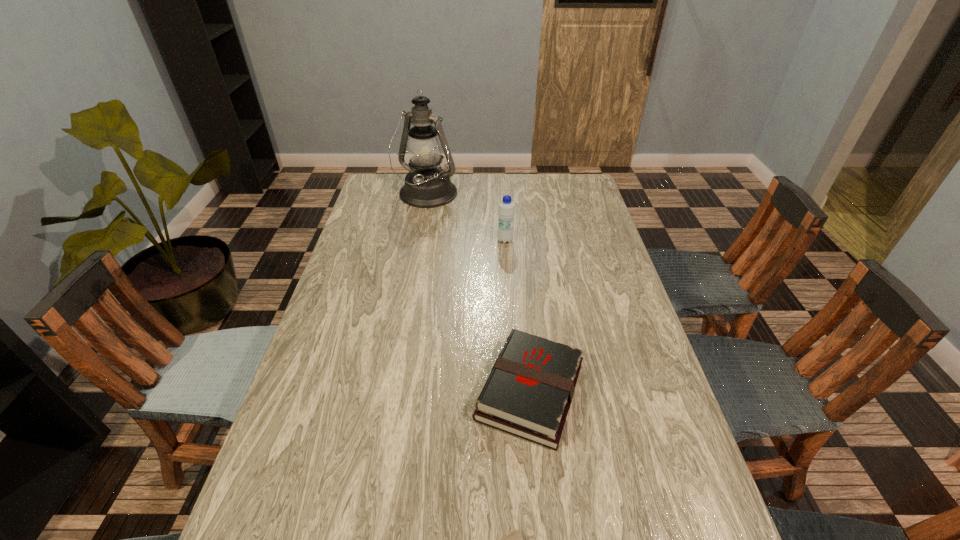
Locate an element on the screen. The height and width of the screenshot is (540, 960). the tallest object is located at coordinates (426, 186).

Identify the location of the farthest object. This screenshot has width=960, height=540. (426, 186).

The height and width of the screenshot is (540, 960). Find the location of `the second farthest object`. the second farthest object is located at coordinates (506, 211).

Locate an element on the screen. This screenshot has height=540, width=960. the second tallest object is located at coordinates (x=506, y=211).

Identify the location of the second nearest object. (528, 394).

I want to click on hardback book, so click(x=528, y=394).

The width and height of the screenshot is (960, 540). I want to click on free region located on the right of the oil lamp, so click(526, 195).

Locate an element on the screen. This screenshot has height=540, width=960. free location located 0.200m on the back of the third shortest object is located at coordinates click(x=503, y=205).

You are a GUI agent. You are given a task and a screenshot of the screen. Output one action in this format:
    pyautogui.click(x=<x>, y=<y>)
    Task: Click on the blank space located on the left of the second shortest object
    The width and height of the screenshot is (960, 540).
    Given the screenshot: What is the action you would take?
    pyautogui.click(x=359, y=392)

This screenshot has width=960, height=540. Identify the location of object present at the far edge. (426, 186).